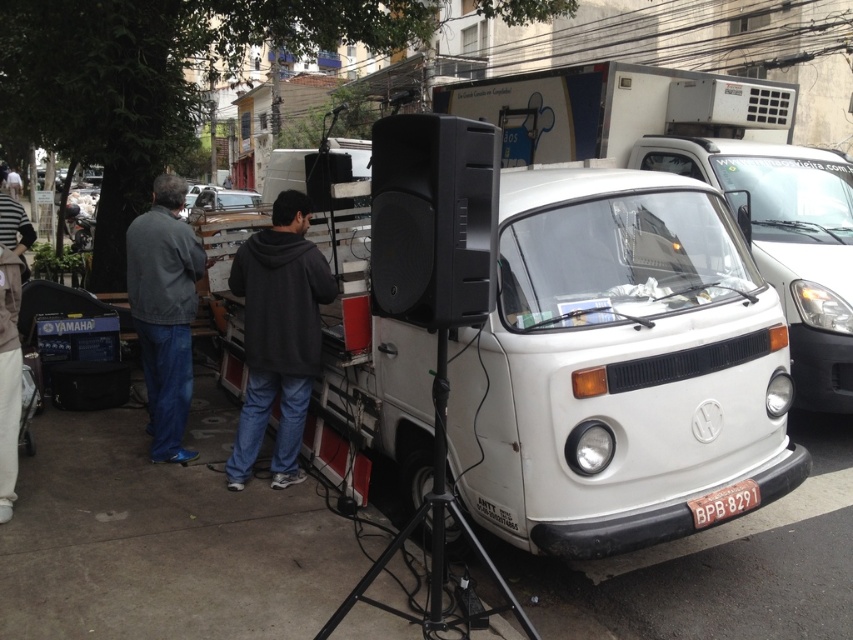
You are a delivery person who needs to park your 2.5 meter long delivery van between the white matte van at center and the dark gray hoodie at center. Is there enough space between them to park your van?

The distance between the white matte van at center and the dark gray hoodie at center is 4.21 meters. Since your delivery van is 2.5 meters long, there is sufficient space to park between them as 4.21 meters is greater than 2.5 meters.

You are a delivery person trying to park your truck between the white matte van at center and the metallic silver car at center. Your truck is 2 meters wide. Can you fit your truck between them?

The white matte van at center has a lesser width compared to metallic silver car at center, so the space between them may vary. However, since the exact distance isn not provided, it is uncertain if the truck can fit. Please check the actual space available.

You are a delivery person who needs to unload a package from the metallic silver car at center. The black metal tripod at center is blocking your way. Can you move the tripod to the side to access the car?

The black metal tripod at center is below the metallic silver car at center, so it is positioned under the car and cannot be moved without first moving the car, making it impossible to access the car without removing the tripod first.